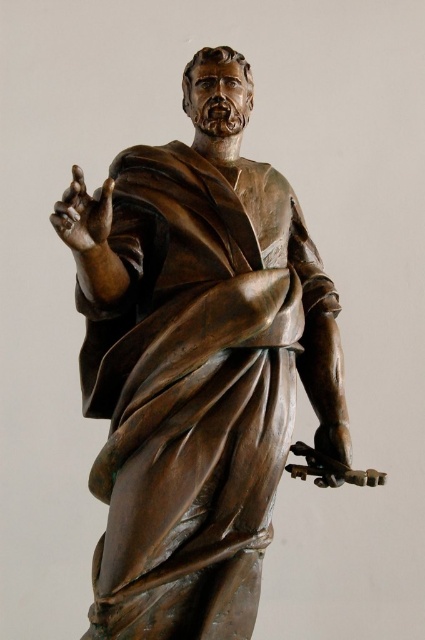
Question: Can you confirm if bronze statue at center is bigger than bronze statue hand at upper left?

Choices:
 (A) yes
 (B) no

Answer: (A)

Question: Is bronze statue at center wider than bronze statue hand at lower right?

Choices:
 (A) yes
 (B) no

Answer: (A)

Question: Is bronze statue hand at upper left above bronze statue hand at lower right?

Choices:
 (A) yes
 (B) no

Answer: (A)

Question: Among these objects, which one is nearest to the camera?

Choices:
 (A) bronze statue at center
 (B) bronze statue hand at upper left

Answer: (B)

Question: Which point is closer to the camera taking this photo?

Choices:
 (A) (99, 192)
 (B) (329, 456)

Answer: (A)

Question: Which of the following is the closest to the observer?

Choices:
 (A) (104, 301)
 (B) (325, 458)

Answer: (B)